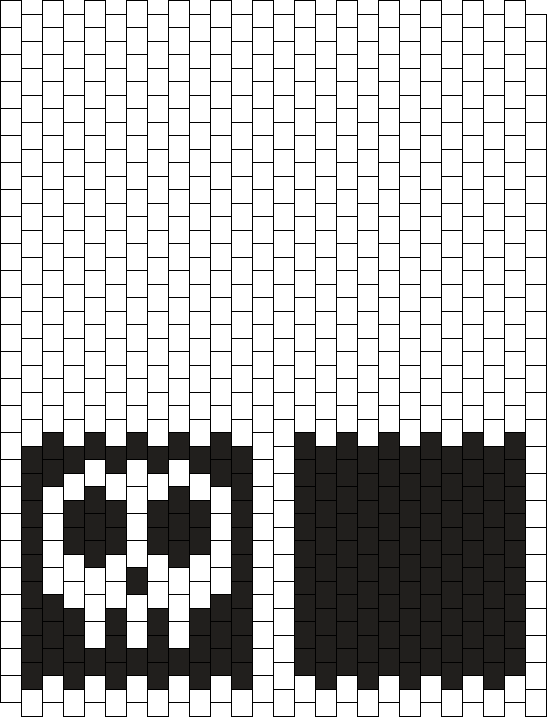
The image size is (547, 717). In order to click on black tile background in this screenshot , I will do `click(222, 649)`.